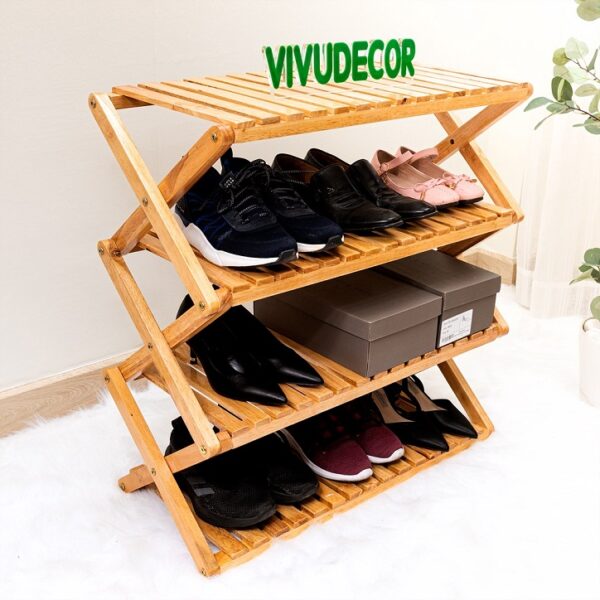
Find the location of a particular element. The image size is (600, 600). shelf levels is located at coordinates (315, 101), (348, 258), (335, 382), (345, 502).